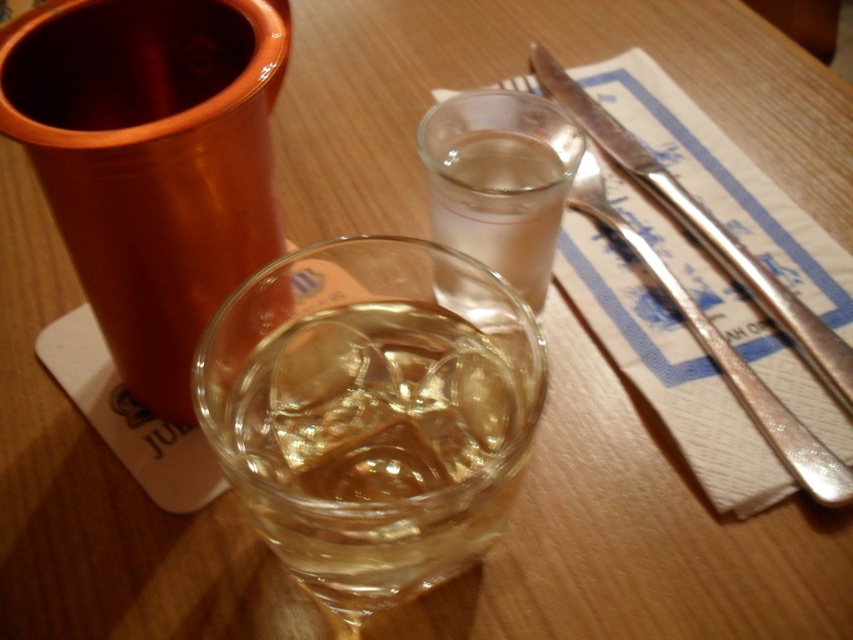
Question: From the image, what is the correct spatial relationship of transparent glass at center in relation to clear glass at upper center?

Choices:
 (A) right
 (B) left

Answer: (B)

Question: Which object is the farthest from the clear glass at upper center?

Choices:
 (A) transparent glass at center
 (B) polished metal knife at upper right

Answer: (A)

Question: Is the position of transparent glass at center less distant than that of polished metal knife at upper right?

Choices:
 (A) no
 (B) yes

Answer: (B)

Question: Does transparent glass at center appear over polished metal knife at upper right?

Choices:
 (A) no
 (B) yes

Answer: (A)

Question: Which object appears closest to the camera in this image?

Choices:
 (A) transparent glass at center
 (B) polished metal knife at upper right
 (C) clear glass at upper center

Answer: (A)

Question: Which point appears closest to the camera in this image?

Choices:
 (A) (329, 504)
 (B) (767, 296)
 (C) (576, 140)

Answer: (A)